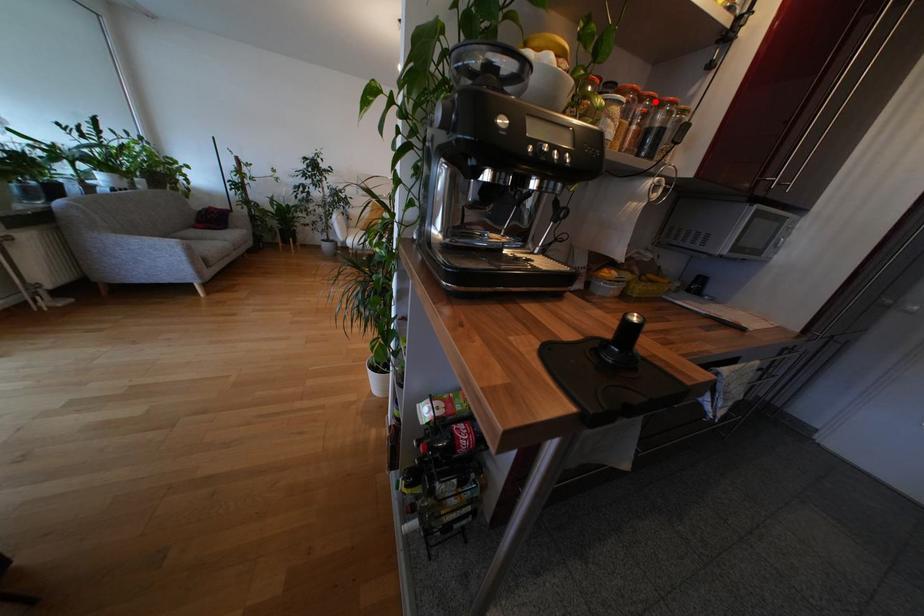
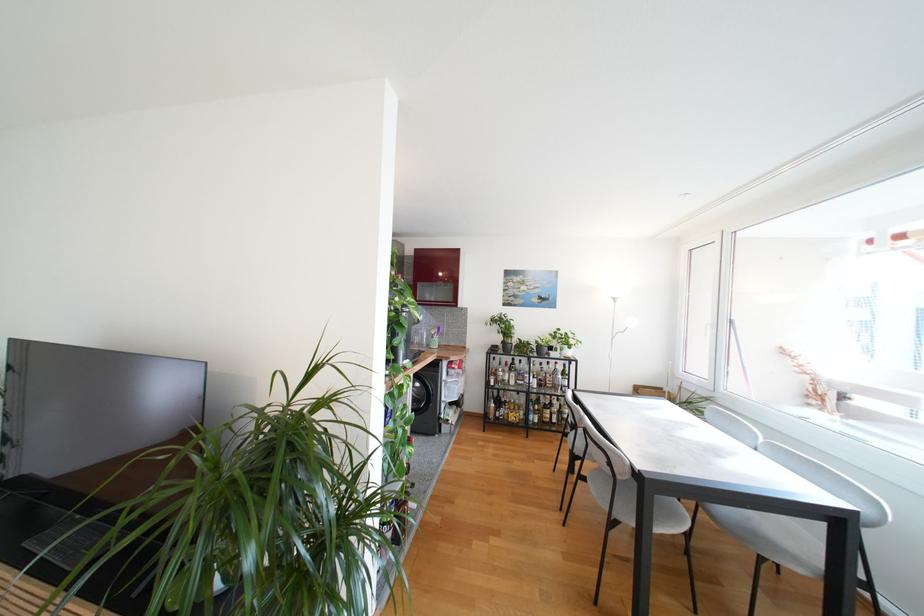
Question: I am providing you with two images of the same scene from different viewpoints. A red point is marked on the first image. Is the red point's position out of view in image 2?

Choices:
 (A) Yes
 (B) No

Answer: (A)